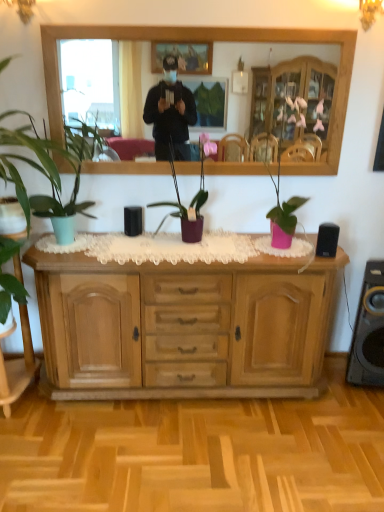
At what (x,y) coordinates should I click in order to perform the action: click on free spot above wooden mirror at upper center (from a real-world perspective). Please return your answer as a coordinate pair (x, y). This screenshot has height=512, width=384. Looking at the image, I should click on (202, 23).